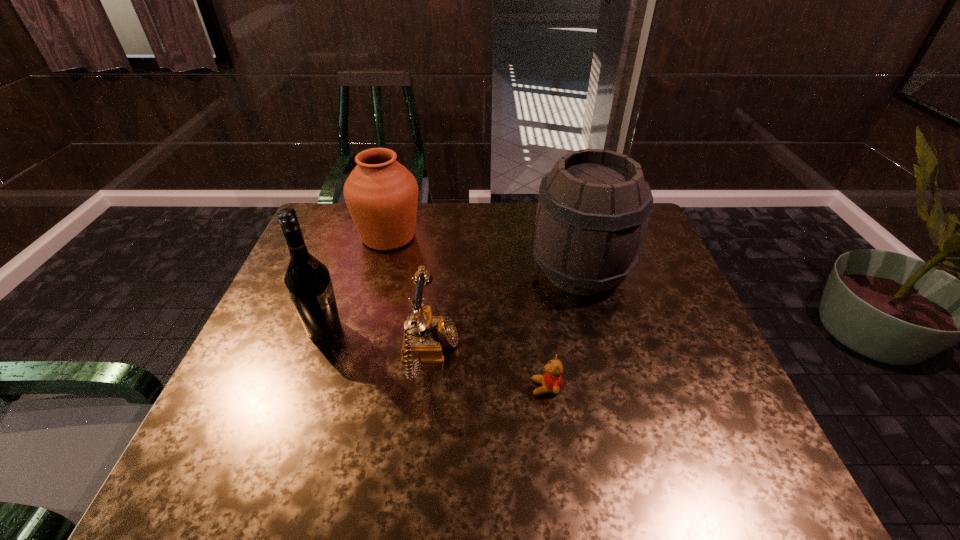
Identify the location of free spot between the wine bottle and the wine bucket. (452, 300).

Find the location of a particular element. vacant area between the teddy bear and the third shortest object is located at coordinates (468, 312).

The width and height of the screenshot is (960, 540). What are the coordinates of `the closest object to the wine bottle` in the screenshot? It's located at (425, 336).

Locate an element on the screen. object that can be found as the fourth closest to the urn is located at coordinates (552, 380).